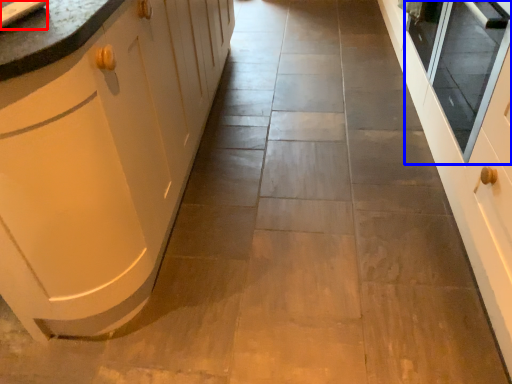
Question: Which point is further to the camera, sink (highlighted by a red box) or window screen (highlighted by a blue box)?

Choices:
 (A) sink
 (B) window screen

Answer: (B)